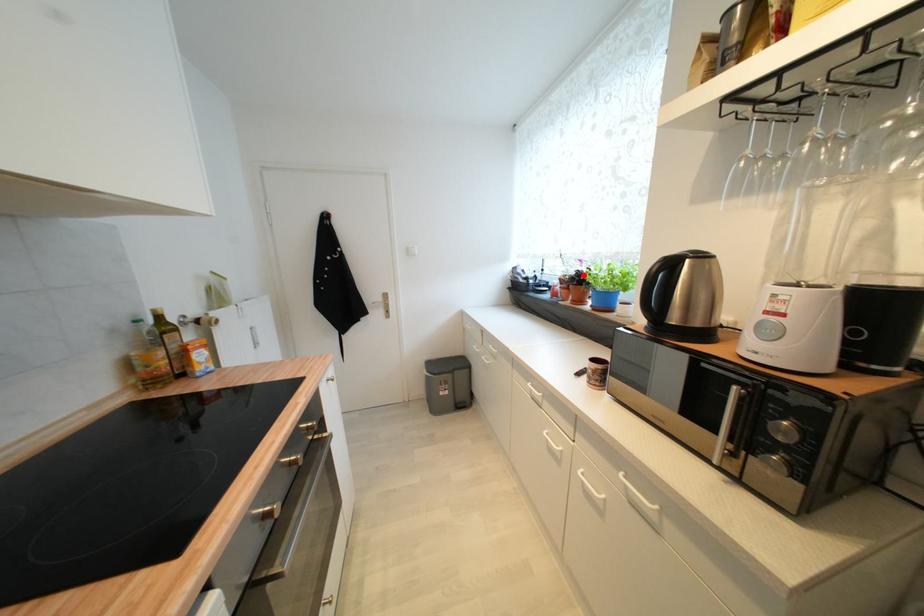
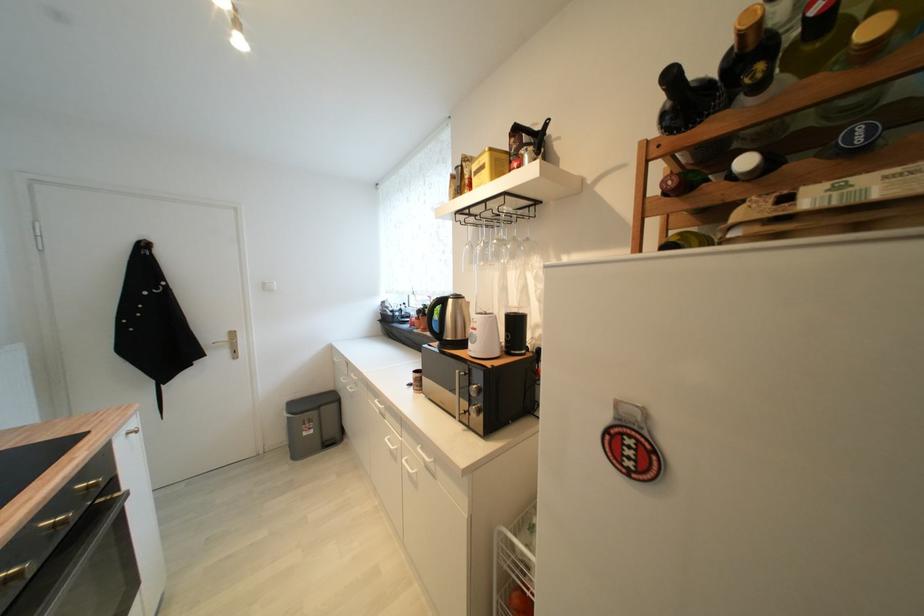
The point at the highlighted location is marked in the first image. Where is the corresponding point in the second image?

(431, 309)